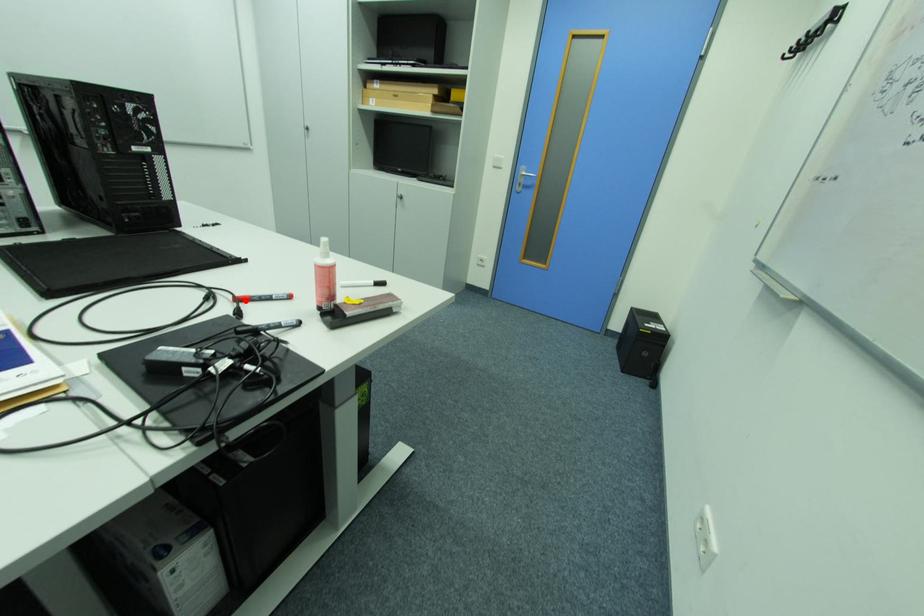
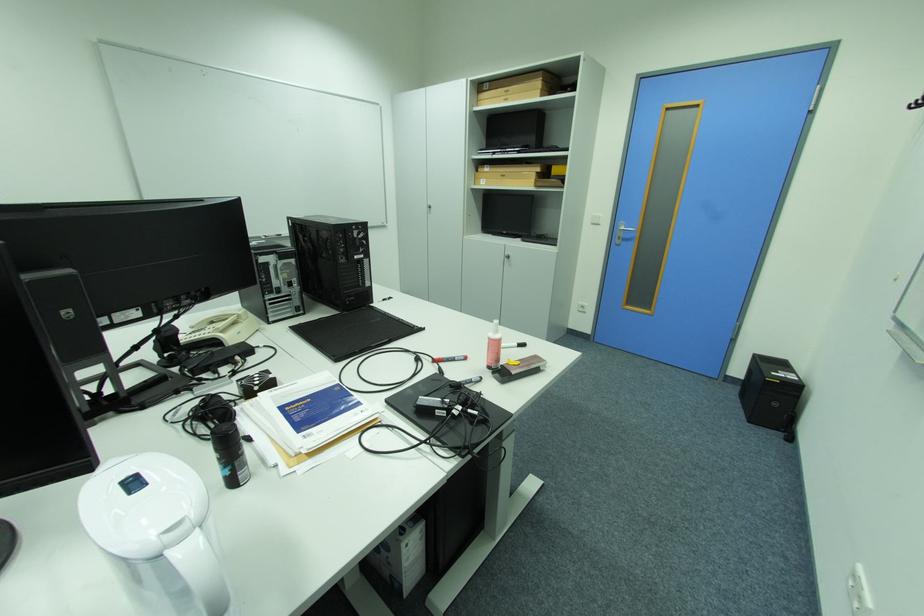
Where in the second image is the point corresponding to the highlighted location from the first image?

(443, 362)